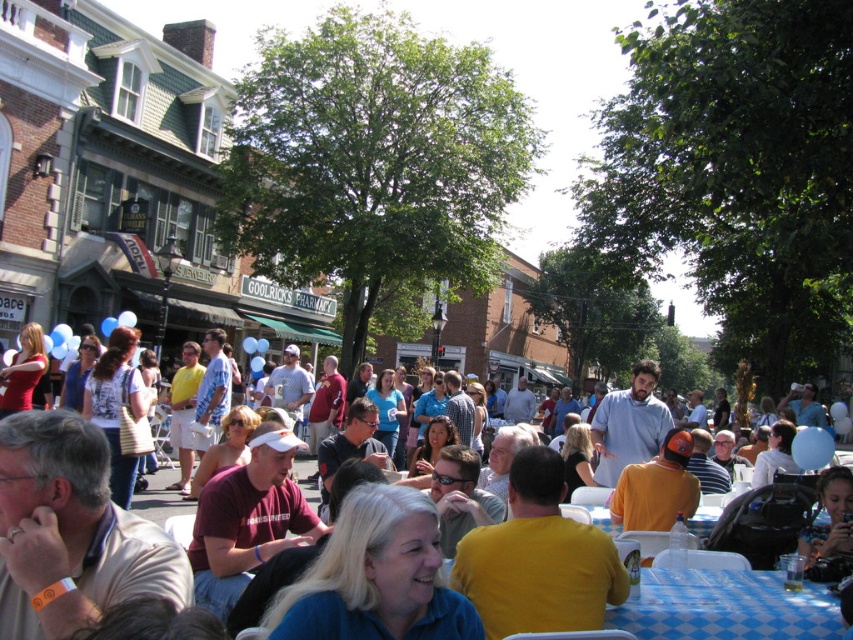
Question: Which point is farther to the camera?

Choices:
 (A) blue checkered tablecloth at lower right
 (B) yellow t-shirt at center

Answer: (A)

Question: Which of the following is the closest to the observer?

Choices:
 (A) yellow t-shirt at center
 (B) blue checkered tablecloth at lower right

Answer: (A)

Question: Among these points, which one is farthest from the camera?

Choices:
 (A) (741, 595)
 (B) (672, 630)

Answer: (A)

Question: In this image, where is yellow t-shirt at center located relative to blue checkered tablecloth at lower right?

Choices:
 (A) left
 (B) right

Answer: (A)

Question: Can you confirm if yellow t-shirt at center is thinner than blue checkered tablecloth at lower right?

Choices:
 (A) yes
 (B) no

Answer: (B)

Question: Where is yellow t-shirt at center located in relation to blue checkered tablecloth at lower right in the image?

Choices:
 (A) right
 (B) left

Answer: (B)